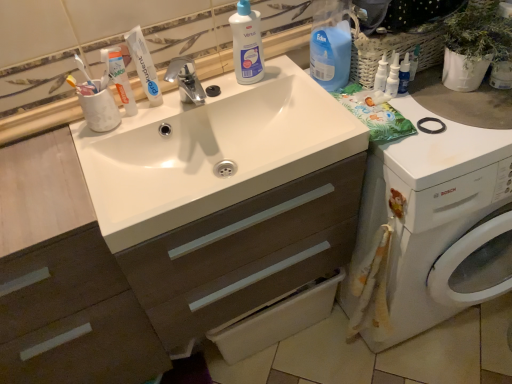
Image resolution: width=512 pixels, height=384 pixels. What are the coordinates of `white glossy spray bottle at upper right, positioned as the second cleaning product in right-to-left order` in the screenshot? It's located at (381, 74).

Measure the distance between point (152, 92) and camera.

Point (152, 92) is 3.47 feet from camera.

This screenshot has height=384, width=512. In order to click on white plastic washing machine at right in this screenshot , I will do `click(434, 225)`.

What do you see at coordinates (330, 44) in the screenshot?
I see `blue plastic bottle at upper right, acting as the second cleaning product starting from the left` at bounding box center [330, 44].

Where is `white glossy spray bottle at upper right, positioned as the second cleaning product in right-to-left order`? white glossy spray bottle at upper right, positioned as the second cleaning product in right-to-left order is located at coordinates (381, 74).

Can you confirm if white glossy spray bottle at upper right, positioned as the second cleaning product in right-to-left order, is taller than blue plastic bottle at upper right, acting as the second cleaning product starting from the left?

In fact, white glossy spray bottle at upper right, positioned as the second cleaning product in right-to-left order, may be shorter than blue plastic bottle at upper right, acting as the second cleaning product starting from the left.

In terms of size, does white glossy spray bottle at upper right, positioned as the second cleaning product in right-to-left order, appear bigger or smaller than blue plastic bottle at upper right, acting as the second cleaning product starting from the left?

Clearly, white glossy spray bottle at upper right, positioned as the second cleaning product in right-to-left order, is smaller in size than blue plastic bottle at upper right, acting as the second cleaning product starting from the left.

Looking at this image, from their relative heights in the image, would you say white glossy sink at center is taller or shorter than yellow-bristled toothbrush at upper left?

white glossy sink at center is taller than yellow-bristled toothbrush at upper left.

Can you confirm if white glossy sink at center is bigger than yellow-bristled toothbrush at upper left?

Correct, white glossy sink at center is larger in size than yellow-bristled toothbrush at upper left.

From the image's perspective, which object appears higher, white glossy sink at center or yellow-bristled toothbrush at upper left?

From the image's view, yellow-bristled toothbrush at upper left is above.

Considering the relative positions of white glossy sink at center and yellow-bristled toothbrush at upper left in the image provided, is white glossy sink at center in front of yellow-bristled toothbrush at upper left?

Yes, white glossy sink at center is closer to the viewer.

Looking at this image, considering the positions of objects white glossy sink at center and blue plastic bottle at upper right, acting as the third cleaning product starting from the right, in the image provided, who is more to the right, white glossy sink at center or blue plastic bottle at upper right, acting as the third cleaning product starting from the right,?

From the viewer's perspective, blue plastic bottle at upper right, acting as the third cleaning product starting from the right, appears more on the right side.

Is the position of white glossy sink at center more distant than that of blue plastic bottle at upper right, acting as the second cleaning product starting from the left?

That is False.

Considering the sizes of objects white glossy sink at center and blue plastic bottle at upper right, acting as the second cleaning product starting from the left, in the image provided, who is thinner, white glossy sink at center or blue plastic bottle at upper right, acting as the second cleaning product starting from the left,?

Thinner between the two is blue plastic bottle at upper right, acting as the second cleaning product starting from the left.

Is white glossy sink at center shorter than blue plastic bottle at upper right, acting as the second cleaning product starting from the left?

No.

Considering the sizes of objects white glossy spray bottle at upper right, the fourth cleaning product from the left, and white glossy spray bottle at upper right, positioned as the second cleaning product in right-to-left order, in the image provided, who is thinner, white glossy spray bottle at upper right, the fourth cleaning product from the left, or white glossy spray bottle at upper right, positioned as the second cleaning product in right-to-left order,?

white glossy spray bottle at upper right, positioned as the second cleaning product in right-to-left order, is thinner.

Can you confirm if white glossy spray bottle at upper right, the fourth cleaning product from the left, is smaller than white glossy spray bottle at upper right, positioned as the second cleaning product in right-to-left order?

No.

How far apart are white glossy spray bottle at upper right, the fourth cleaning product from the left, and white glossy spray bottle at upper right, acting as the 3th cleaning product starting from the left?

A distance of 0.95 inches exists between white glossy spray bottle at upper right, the fourth cleaning product from the left, and white glossy spray bottle at upper right, acting as the 3th cleaning product starting from the left.

From the image's perspective, between white glossy spray bottle at upper right, placed as the 1th cleaning product when sorted from right to left, and white glossy spray bottle at upper right, positioned as the second cleaning product in right-to-left order, who is located below?

From the image's view, white glossy spray bottle at upper right, placed as the 1th cleaning product when sorted from right to left, is below.

From a real-world perspective, is white glossy spray bottle at upper right, acting as the 3th cleaning product starting from the left, physically below yellow-bristled toothbrush at upper left?

Yes, from a real-world perspective, white glossy spray bottle at upper right, acting as the 3th cleaning product starting from the left, is beneath yellow-bristled toothbrush at upper left.

Is point (378, 70) positioned before point (85, 77)?

No, it is behind (85, 77).

Considering the relative positions of white glossy spray bottle at upper right, acting as the 3th cleaning product starting from the left, and yellow-bristled toothbrush at upper left in the image provided, is white glossy spray bottle at upper right, acting as the 3th cleaning product starting from the left, to the left of yellow-bristled toothbrush at upper left from the viewer's perspective?

Incorrect, white glossy spray bottle at upper right, acting as the 3th cleaning product starting from the left, is not on the left side of yellow-bristled toothbrush at upper left.

Which is behind, white glossy spray bottle at upper right, positioned as the second cleaning product in right-to-left order, or yellow-bristled toothbrush at upper left?

Positioned behind is white glossy spray bottle at upper right, positioned as the second cleaning product in right-to-left order.

Is yellow-bristled toothbrush at upper left shorter than white glossy toothpaste tube at upper left?

Indeed, yellow-bristled toothbrush at upper left has a lesser height compared to white glossy toothpaste tube at upper left.

Is yellow-bristled toothbrush at upper left closer to the viewer compared to white glossy toothpaste tube at upper left?

Yes, the depth of yellow-bristled toothbrush at upper left is less than that of white glossy toothpaste tube at upper left.

Which of these two, yellow-bristled toothbrush at upper left or white glossy toothpaste tube at upper left, is wider?

With larger width is white glossy toothpaste tube at upper left.

Is yellow-bristled toothbrush at upper left next to white glossy toothpaste tube at upper left?

Yes, yellow-bristled toothbrush at upper left is next to white glossy toothpaste tube at upper left.

Considering the positions of points (378, 70) and (399, 327), is point (378, 70) closer to camera compared to point (399, 327)?

Yes, it is.

Does white glossy spray bottle at upper right, acting as the 3th cleaning product starting from the left, have a greater height compared to white plastic washing machine at right?

No, white glossy spray bottle at upper right, acting as the 3th cleaning product starting from the left, is not taller than white plastic washing machine at right.

Considering the sizes of white glossy spray bottle at upper right, acting as the 3th cleaning product starting from the left, and white plastic washing machine at right in the image, is white glossy spray bottle at upper right, acting as the 3th cleaning product starting from the left, bigger or smaller than white plastic washing machine at right?

white glossy spray bottle at upper right, acting as the 3th cleaning product starting from the left, is smaller than white plastic washing machine at right.

Consider the image. Is white glossy spray bottle at upper right, positioned as the second cleaning product in right-to-left order, in front of white plastic washing machine at right?

No, it is behind white plastic washing machine at right.

From the blue plastic bottle at upper right, acting as the second cleaning product starting from the left, count 3rd cleaning products backward and point to it. Please provide its 2D coordinates.

[(381, 74)]

I want to click on dresser located below the yellow-bristled toothbrush at upper left (from the image's perspective), so click(x=146, y=267).

When comparing their distances from white glossy toothpaste at upper left, does white glossy sink at center or white glossy toothpaste tube at upper left seem closer?

Among the two, white glossy toothpaste tube at upper left is located nearer to white glossy toothpaste at upper left.

Based on the photo, based on their spatial positions, is white glossy sink at center or white glossy toothpaste at upper left further from white glossy spray bottle at upper right, placed as the 1th cleaning product when sorted from right to left?

Based on the image, white glossy toothpaste at upper left appears to be further to white glossy spray bottle at upper right, placed as the 1th cleaning product when sorted from right to left.

Estimate the real-world distances between objects in this image. Which object is further from white glossy spray bottle at upper right, acting as the 3th cleaning product starting from the left, white glossy spray bottle at upper right, placed as the 1th cleaning product when sorted from right to left, or white glossy toothpaste tube at upper left?

white glossy toothpaste tube at upper left lies further to white glossy spray bottle at upper right, acting as the 3th cleaning product starting from the left, than the other object.

From the image, which object appears to be nearer to white glossy spray bottle at upper right, the fourth cleaning product from the left, white glossy sink at center or white glossy bottle at upper center, marked as the first cleaning product in a left-to-right arrangement?

white glossy bottle at upper center, marked as the first cleaning product in a left-to-right arrangement, is positioned closer to the anchor white glossy spray bottle at upper right, the fourth cleaning product from the left.

Considering their positions, is white glossy bottle at upper center, marked as the first cleaning product in a left-to-right arrangement, positioned further to yellow-bristled toothbrush at upper left than white plastic washing machine at right?

white plastic washing machine at right.

Looking at the image, which one is located closer to white glossy sink at center, white glossy spray bottle at upper right, the fourth cleaning product from the left, or white glossy bottle at upper center, marked as the first cleaning product in a left-to-right arrangement?

Among the two, white glossy bottle at upper center, marked as the first cleaning product in a left-to-right arrangement, is located nearer to white glossy sink at center.

From the image, which object appears to be nearer to white glossy bottle at upper center, marked as the first cleaning product in a left-to-right arrangement, white glossy sink at center or white glossy sink at center?

Among the two, white glossy sink at center is located nearer to white glossy bottle at upper center, marked as the first cleaning product in a left-to-right arrangement.

When comparing their distances from white glossy bottle at upper center, arranged as the fourth cleaning product when viewed from the right, does blue plastic bottle at upper right, acting as the third cleaning product starting from the right, or white glossy sink at center seem closer?

The object closer to white glossy bottle at upper center, arranged as the fourth cleaning product when viewed from the right, is blue plastic bottle at upper right, acting as the third cleaning product starting from the right.

You are a GUI agent. You are given a task and a screenshot of the screen. Output one action in this format:
    pyautogui.click(x=<x>, y=<y>)
    Task: Click on the toothpaste between white glossy toothpaste tube at upper left and white glossy sink at center
    Image resolution: width=512 pixels, height=384 pixels.
    Given the screenshot: What is the action you would take?
    pyautogui.click(x=144, y=65)

Locate an element on the screen. sink between white glossy toothpaste tube at upper left and white glossy bottle at upper center, arranged as the fourth cleaning product when viewed from the right, in the horizontal direction is located at coordinates (211, 152).

I want to click on toiletry located between yellow-bristled toothbrush at upper left and white glossy spray bottle at upper right, placed as the 1th cleaning product when sorted from right to left, in the left-right direction, so click(120, 78).

The width and height of the screenshot is (512, 384). What are the coordinates of `toothpaste between white glossy toothpaste tube at upper left and white plastic washing machine at right from left to right` in the screenshot? It's located at (144, 65).